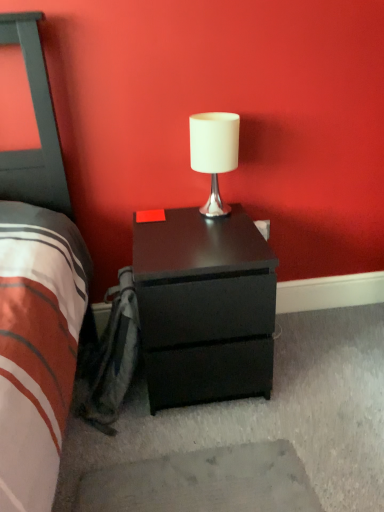
Question: Is matte black nightstand at center wider than white matte table lamp at center?

Choices:
 (A) no
 (B) yes

Answer: (B)

Question: Is matte black nightstand at center far away from white matte table lamp at center?

Choices:
 (A) no
 (B) yes

Answer: (A)

Question: Considering the relative positions of matte black nightstand at center and white matte table lamp at center in the image provided, is matte black nightstand at center in front of white matte table lamp at center?

Choices:
 (A) no
 (B) yes

Answer: (B)

Question: From a real-world perspective, is matte black nightstand at center located beneath white matte table lamp at center?

Choices:
 (A) no
 (B) yes

Answer: (B)

Question: Considering the relative positions of matte black nightstand at center and white matte table lamp at center in the image provided, is matte black nightstand at center to the left of white matte table lamp at center from the viewer's perspective?

Choices:
 (A) yes
 (B) no

Answer: (A)

Question: From the image's perspective, is matte black nightstand at center on top of white matte table lamp at center?

Choices:
 (A) no
 (B) yes

Answer: (A)

Question: Can you confirm if white matte table lamp at center is smaller than matte black nightstand at center?

Choices:
 (A) yes
 (B) no

Answer: (A)

Question: Can you confirm if white matte table lamp at center is positioned to the right of matte black nightstand at center?

Choices:
 (A) yes
 (B) no

Answer: (A)

Question: Is white matte table lamp at center taller than matte black nightstand at center?

Choices:
 (A) yes
 (B) no

Answer: (B)

Question: Is matte black nightstand at center at the back of white matte table lamp at center?

Choices:
 (A) no
 (B) yes

Answer: (A)

Question: Considering the relative positions of white matte table lamp at center and matte black nightstand at center in the image provided, is white matte table lamp at center behind matte black nightstand at center?

Choices:
 (A) yes
 (B) no

Answer: (A)

Question: Does white matte table lamp at center have a greater width compared to matte black nightstand at center?

Choices:
 (A) yes
 (B) no

Answer: (B)

Question: Choose the correct answer: Is matte black nightstand at center inside white matte table lamp at center or outside it?

Choices:
 (A) inside
 (B) outside

Answer: (B)